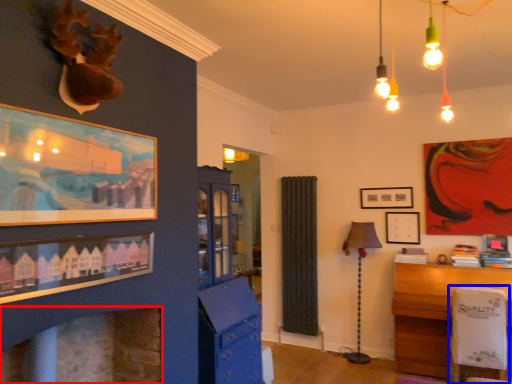
Question: Which object is closer to the camera taking this photo, fireplace (highlighted by a red box) or swivel chair (highlighted by a blue box)?

Choices:
 (A) fireplace
 (B) swivel chair

Answer: (A)